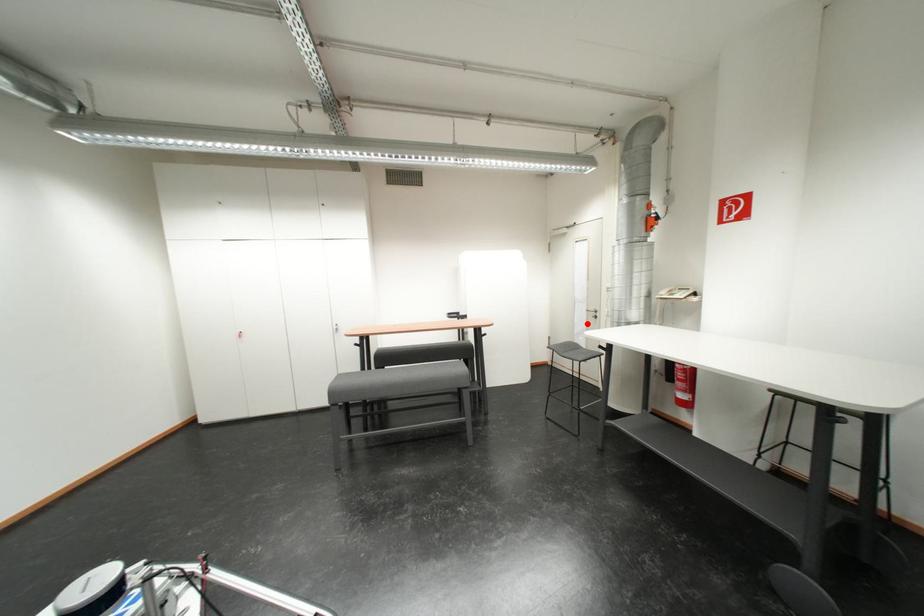
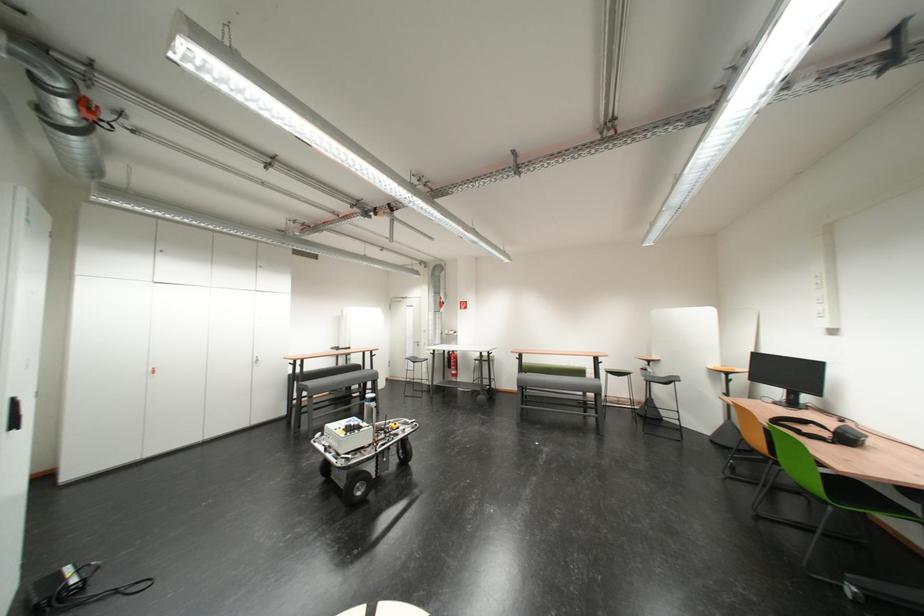
Question: A red point is marked in image1. In image2, is the corresponding 3D point closer to the camera or farther? Reply with the corresponding letter.

Choices:
 (A) The corresponding 3D point is closer.
 (B) The corresponding 3D point is farther.

Answer: (B)